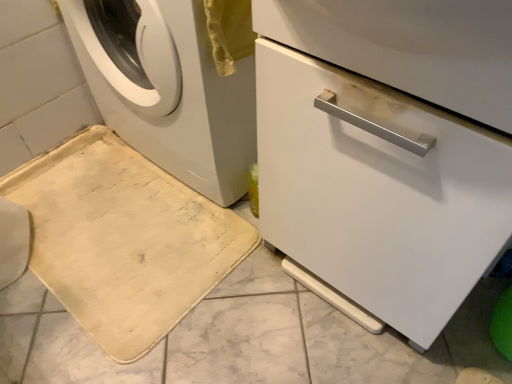
Question: In terms of height, does white glossy dishwasher at center look taller or shorter compared to beige fabric bath mat at lower left?

Choices:
 (A) short
 (B) tall

Answer: (B)

Question: In terms of size, does white glossy dishwasher at center appear bigger or smaller than beige fabric bath mat at lower left?

Choices:
 (A) big
 (B) small

Answer: (A)

Question: Which of these objects is positioned farthest from the white matte washing machine at left?

Choices:
 (A) white glossy dishwasher at center
 (B) beige fabric bath mat at lower left

Answer: (A)

Question: Which of these objects is positioned farthest from the white glossy dishwasher at center?

Choices:
 (A) white matte washing machine at left
 (B) beige fabric bath mat at lower left

Answer: (B)